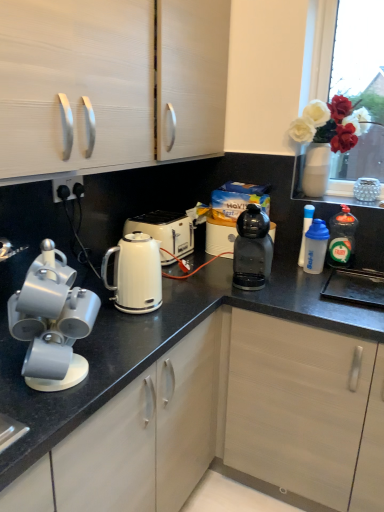
Question: Is the position of black plastic socket at lower left less distant than that of black plastic coffee machine at center?

Choices:
 (A) yes
 (B) no

Answer: (A)

Question: Is black plastic socket at lower left aimed at black plastic coffee machine at center?

Choices:
 (A) no
 (B) yes

Answer: (A)

Question: Is black plastic socket at lower left positioned behind black plastic coffee machine at center?

Choices:
 (A) no
 (B) yes

Answer: (A)

Question: Considering the relative sizes of black plastic socket at lower left and black plastic coffee machine at center in the image provided, is black plastic socket at lower left wider than black plastic coffee machine at center?

Choices:
 (A) no
 (B) yes

Answer: (A)

Question: Considering the relative sizes of black plastic socket at lower left and black plastic coffee machine at center in the image provided, is black plastic socket at lower left shorter than black plastic coffee machine at center?

Choices:
 (A) yes
 (B) no

Answer: (A)

Question: From the image's perspective, is black plastic socket at lower left located beneath black plastic coffee machine at center?

Choices:
 (A) no
 (B) yes

Answer: (A)

Question: Considering the relative sizes of black plastic socket at lower left and white plastic toaster at upper center in the image provided, is black plastic socket at lower left wider than white plastic toaster at upper center?

Choices:
 (A) no
 (B) yes

Answer: (A)

Question: Does black plastic socket at lower left turn towards white plastic toaster at upper center?

Choices:
 (A) yes
 (B) no

Answer: (A)

Question: Considering the relative positions of black plastic socket at lower left and white plastic toaster at upper center in the image provided, is black plastic socket at lower left behind white plastic toaster at upper center?

Choices:
 (A) no
 (B) yes

Answer: (A)

Question: From the image's perspective, does black plastic socket at lower left appear higher than white plastic toaster at upper center?

Choices:
 (A) no
 (B) yes

Answer: (B)

Question: From a real-world perspective, is black plastic socket at lower left positioned under white plastic toaster at upper center based on gravity?

Choices:
 (A) no
 (B) yes

Answer: (A)

Question: Is black plastic socket at lower left looking in the opposite direction of white plastic toaster at upper center?

Choices:
 (A) no
 (B) yes

Answer: (B)

Question: From a real-world perspective, is matte white cabinet at upper left on translucent plastic dishwashing liquid at right, the 1th kitchen appliance in the right-to-left sequence?

Choices:
 (A) yes
 (B) no

Answer: (A)